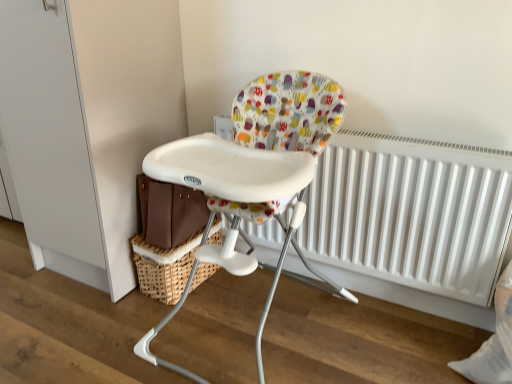
Question: Does white plastic highchair at center come behind woven brown basket at lower left?

Choices:
 (A) no
 (B) yes

Answer: (A)

Question: From a real-world perspective, does white plastic highchair at center stand above woven brown basket at lower left?

Choices:
 (A) yes
 (B) no

Answer: (A)

Question: Is woven brown basket at lower left a part of white plastic highchair at center?

Choices:
 (A) no
 (B) yes

Answer: (A)

Question: Does white plastic highchair at center turn towards woven brown basket at lower left?

Choices:
 (A) yes
 (B) no

Answer: (B)

Question: Is white plastic highchair at center thinner than woven brown basket at lower left?

Choices:
 (A) yes
 (B) no

Answer: (B)

Question: In the image, is white plastic highchair at center on the left side or the right side of white matte radiator at center?

Choices:
 (A) right
 (B) left

Answer: (B)

Question: Is point (272, 125) closer or farther from the camera than point (457, 233)?

Choices:
 (A) farther
 (B) closer

Answer: (A)

Question: Choose the correct answer: Is white plastic highchair at center inside white matte radiator at center or outside it?

Choices:
 (A) outside
 (B) inside

Answer: (A)

Question: Looking at the image, does white plastic highchair at center seem bigger or smaller compared to white matte radiator at center?

Choices:
 (A) big
 (B) small

Answer: (A)

Question: Is point (315, 142) closer or farther from the camera than point (205, 271)?

Choices:
 (A) farther
 (B) closer

Answer: (B)

Question: From a real-world perspective, is white plastic highchair at center positioned above or below woven brown basket at lower left?

Choices:
 (A) below
 (B) above

Answer: (B)

Question: In the image, is white plastic highchair at center positioned in front of or behind woven brown basket at lower left?

Choices:
 (A) front
 (B) behind

Answer: (A)

Question: Do you think white plastic highchair at center is within woven brown basket at lower left, or outside of it?

Choices:
 (A) inside
 (B) outside

Answer: (B)

Question: Is white matte radiator at center in front of or behind woven brown basket at lower left in the image?

Choices:
 (A) behind
 (B) front

Answer: (B)

Question: From the image's perspective, is white matte radiator at center positioned above or below woven brown basket at lower left?

Choices:
 (A) above
 (B) below

Answer: (A)